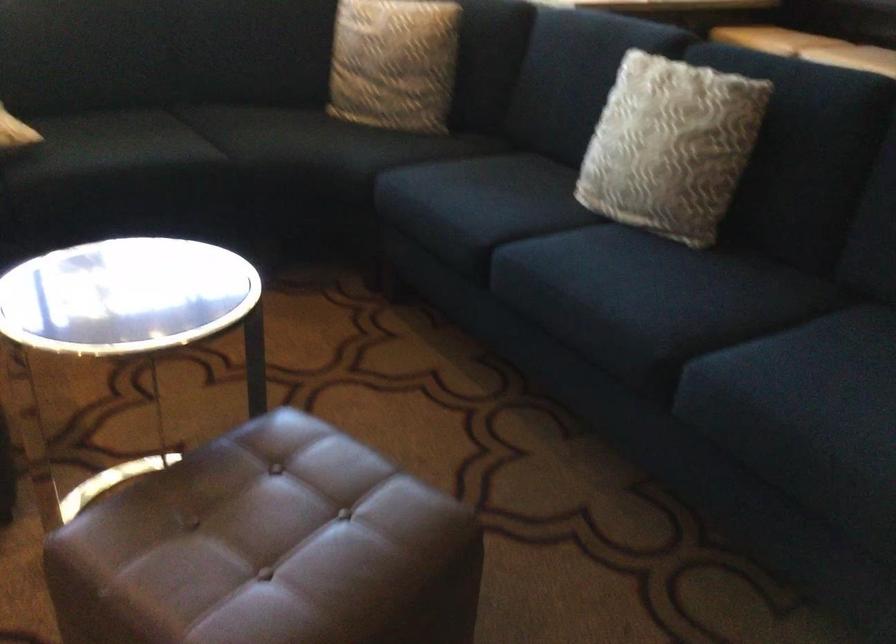
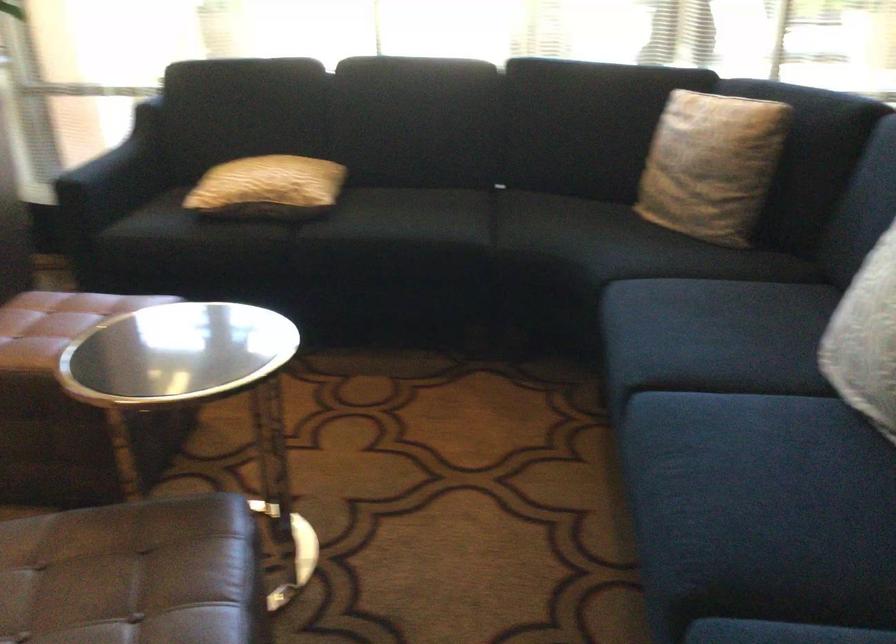
Question: The camera is either moving clockwise (left) or counter-clockwise (right) around the object. The first image is from the beginning of the video and the second image is from the end. Is the camera moving left or right when shooting the video?

Choices:
 (A) Left
 (B) Right

Answer: (B)